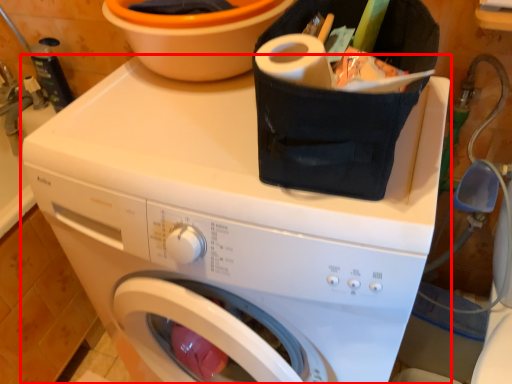
Question: From the image's perspective, where is washing machine (annotated by the red box) located in relation to basin in the image?

Choices:
 (A) below
 (B) above

Answer: (A)